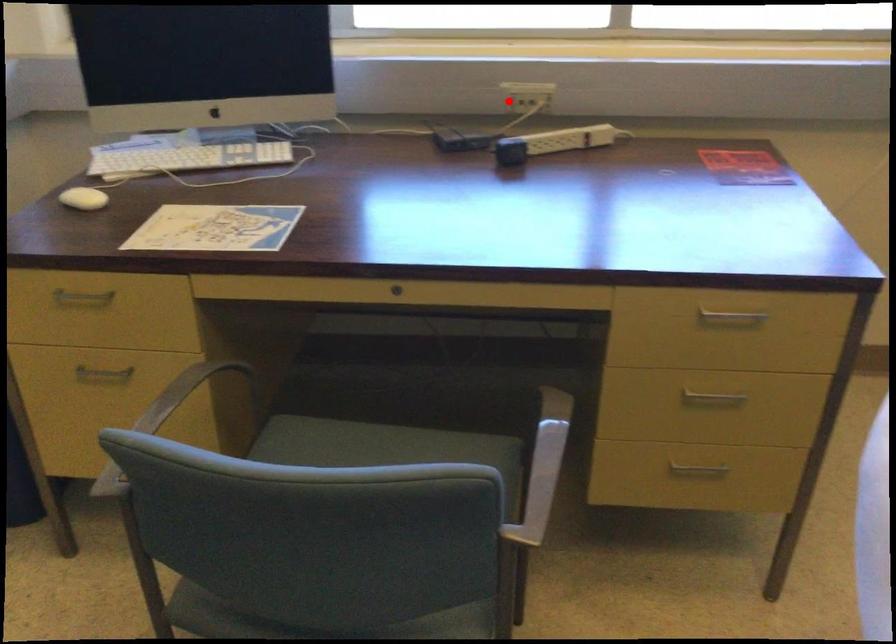
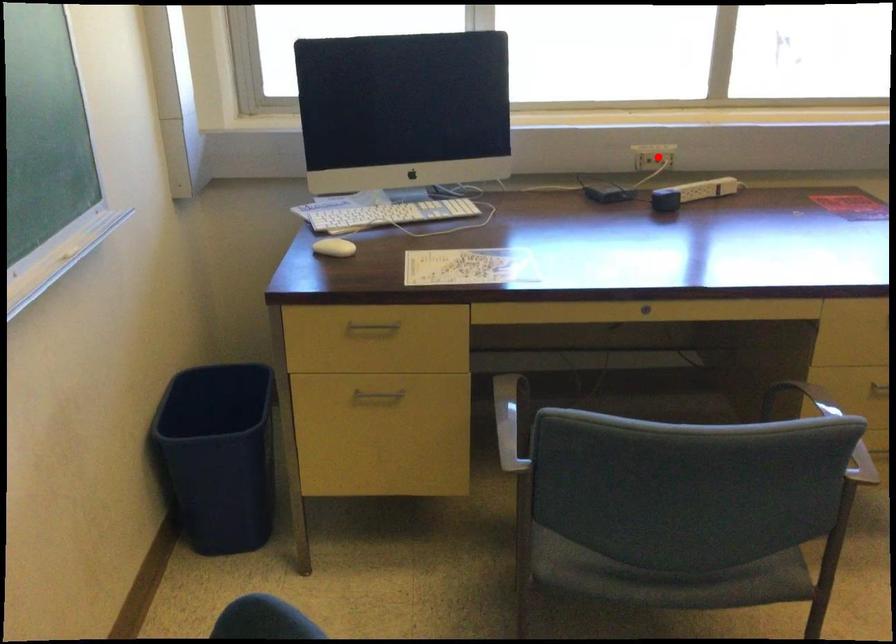
I am providing you with two images of the same scene from different viewpoints. A red point is marked on the first image and another point is marked on the second image. Is the marked point in image1 the same physical position as the marked point in image2?

No